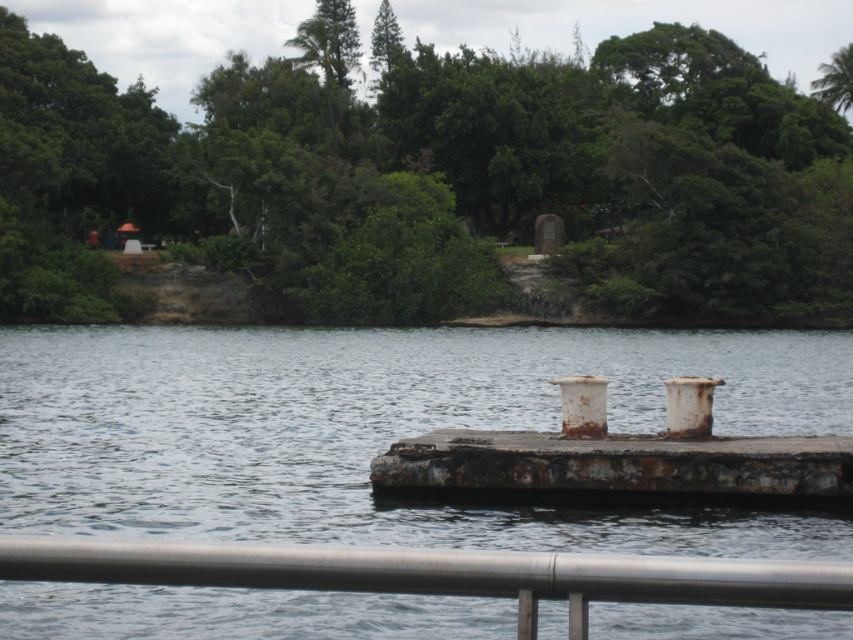
You are standing on a bridge overlooking a river. You see the rusty metallic water at center and the rusty metal dock at center. Which object is closer to you?

The rusty metallic water at center is closer to you because it is in front of the rusty metal dock at center.

You are standing on the bridge looking at the scene. Which object is closer to the left side of your view? The rusty metallic water at center or the silver metallic rail at lower center?

The rusty metallic water at center is closer to the left side of your view because it is positioned to the left of the silver metallic rail at lower center.